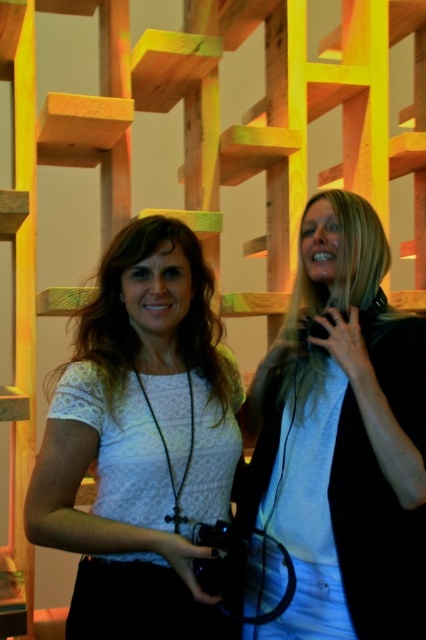
Does light blue denim jeans at center appear on the left side of white lace shirt at center?

Incorrect, light blue denim jeans at center is not on the left side of white lace shirt at center.

Is point (393, 532) positioned before point (86, 442)?

That is False.

What do you see at coordinates (342, 438) in the screenshot?
I see `light blue denim jeans at center` at bounding box center [342, 438].

At what (x,y) coordinates should I click in order to perform the action: click on light blue denim jeans at center. Please return your answer as a coordinate pair (x, y). This screenshot has width=426, height=640. Looking at the image, I should click on (342, 438).